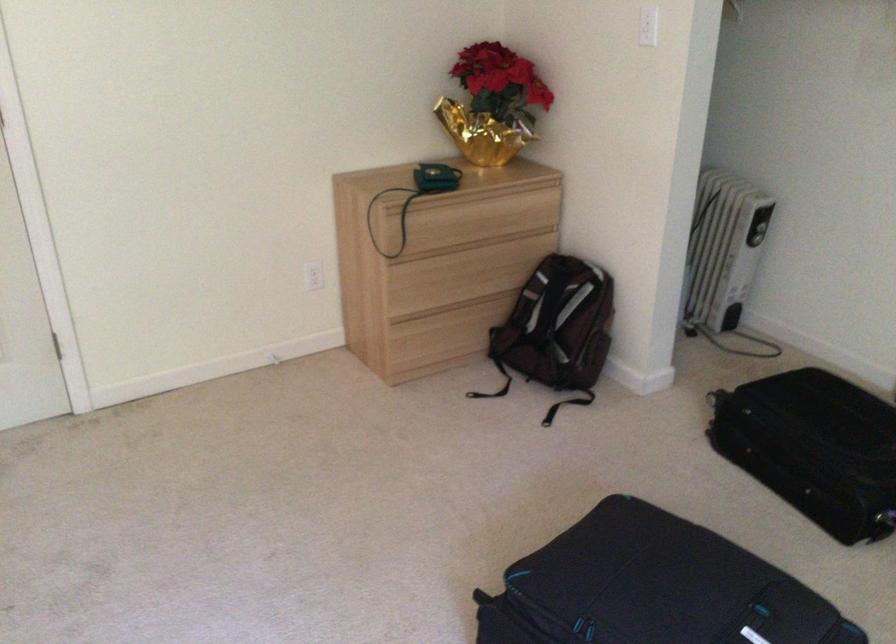
Where is `the bottom drawer front`? the bottom drawer front is located at coordinates (442, 345).